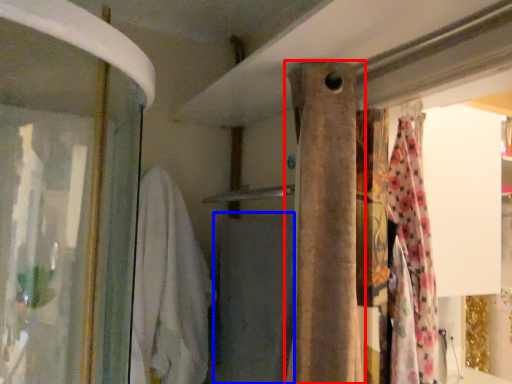
Question: Among these objects, which one is nearest to the camera, curtain (highlighted by a red box) or bath towel (highlighted by a blue box)?

Choices:
 (A) curtain
 (B) bath towel

Answer: (A)